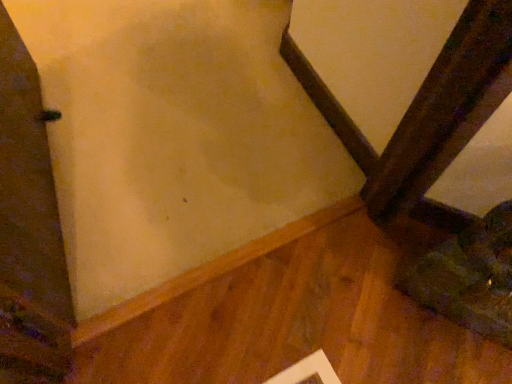
Describe the element at coordinates (307, 371) in the screenshot. I see `white matte paper at lower center` at that location.

You are a GUI agent. You are given a task and a screenshot of the screen. Output one action in this format:
    pyautogui.click(x=<x>, y=<y>)
    Task: Click on the white matte paper at lower center
    The height and width of the screenshot is (384, 512).
    Given the screenshot: What is the action you would take?
    pyautogui.click(x=307, y=371)

Find the location of `white matte paper at lower center`. white matte paper at lower center is located at coordinates (307, 371).